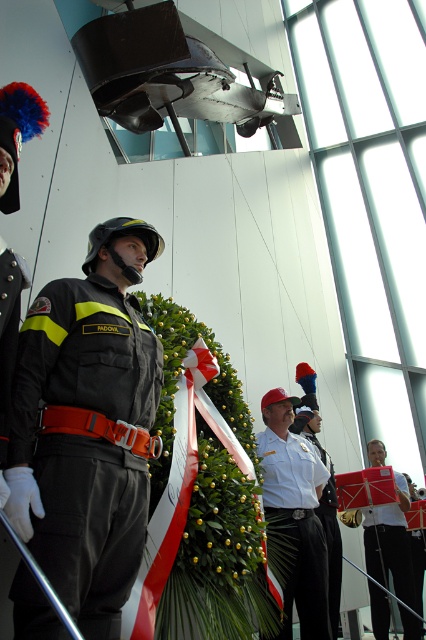
You are attending the event and need to locate the two individuals wearing the dark gray matte uniform at left and the white cotton shirt at center. From your perspective facing the scene, which one is positioned closer to the left side of the room?

The dark gray matte uniform at left is positioned to the left of the white cotton shirt at center, so the dark gray matte uniform at left is closer to the left side of the room.

You are standing at the camera position and want to hand a document to the person in the matte black uniform at lower right. The document is 2 meters long. Can you reach them without moving from your current position?

The distance between you and the matte black uniform at lower right is 5.30 meters, which is greater than the document length of 2 meters. Therefore, you cannot reach them without moving closer.